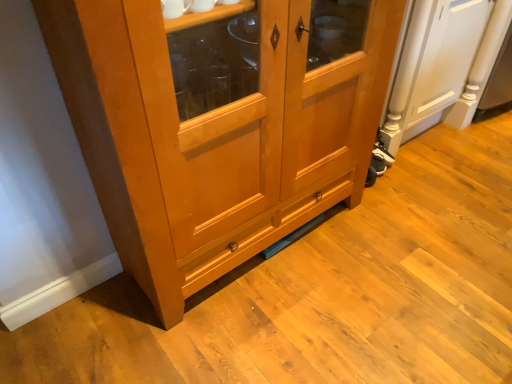
Image resolution: width=512 pixels, height=384 pixels. I want to click on free spot to the right of matte wood cupboard at center, so click(410, 247).